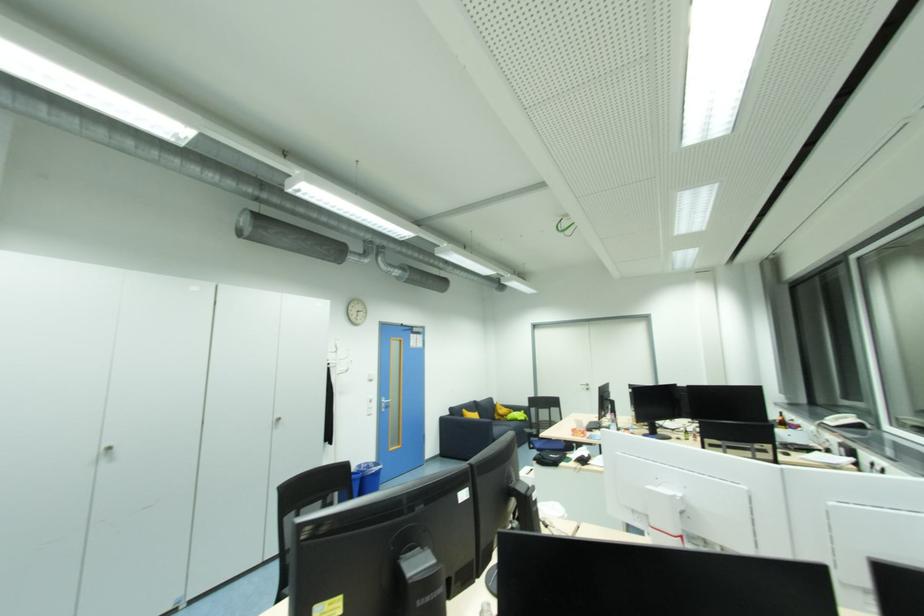
At what (x,y) coordinates should I click in order to perform the action: click on white telephone receiver. Please return your answer as a coordinate pair (x, y). Image resolution: width=924 pixels, height=616 pixels. Looking at the image, I should click on (839, 416).